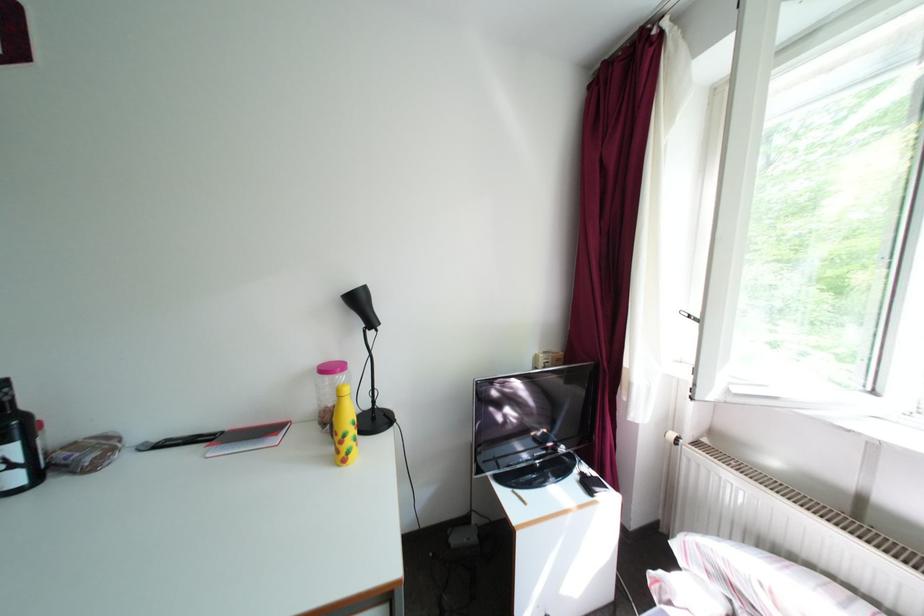
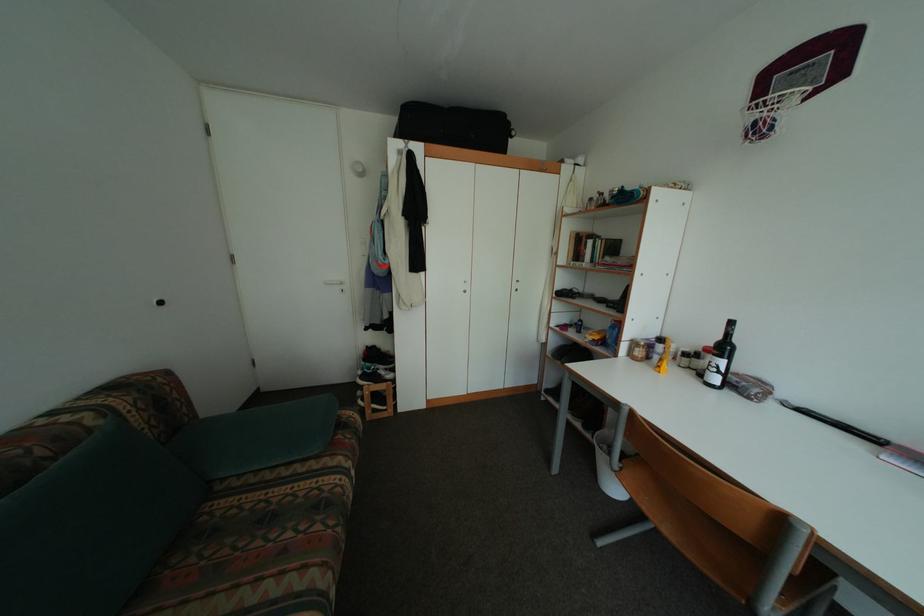
Question: The images are taken continuously from a first-person perspective. In which direction is your viewpoint rotating?

Choices:
 (A) Left
 (B) Right
 (C) Up
 (D) Down

Answer: (A)